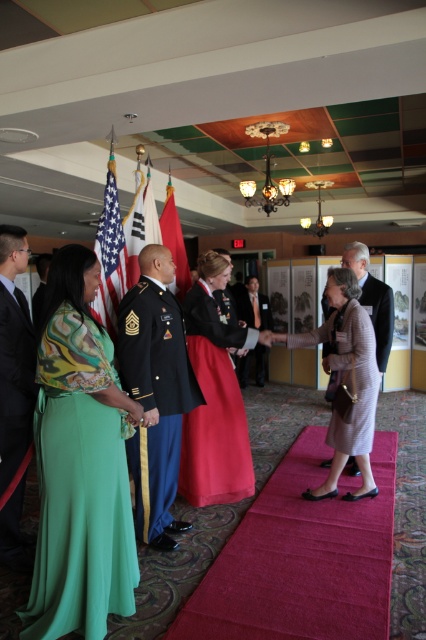
Who is more forward, (152, 513) or (336, 273)?

Point (152, 513) is more forward.

Can you confirm if shiny blue uniform at center is bigger than light brown textured dress at center?

Incorrect, shiny blue uniform at center is not larger than light brown textured dress at center.

Where is `shiny blue uniform at center`? shiny blue uniform at center is located at coordinates (155, 392).

Who is more distant from viewer, (39, 620) or (172, 285)?

The point (172, 285) is behind.

Between green satin dress at left and red silk flag at center, which one appears on the left side from the viewer's perspective?

From the viewer's perspective, green satin dress at left appears more on the left side.

Which is behind, point (66, 408) or point (183, 292)?

The point (183, 292) is more distant.

This screenshot has height=640, width=426. Find the location of `green satin dress at left`. green satin dress at left is located at coordinates (80, 465).

Between red satin dress at center and dark gray wool suit at right, which one has less height?

Standing shorter between the two is dark gray wool suit at right.

Is red satin dress at center above dark gray wool suit at right?

No.

Image resolution: width=426 pixels, height=640 pixels. Describe the element at coordinates (215, 396) in the screenshot. I see `red satin dress at center` at that location.

At what (x,y) coordinates should I click in order to perform the action: click on red satin dress at center. Please return your answer as a coordinate pair (x, y). Looking at the image, I should click on (215, 396).